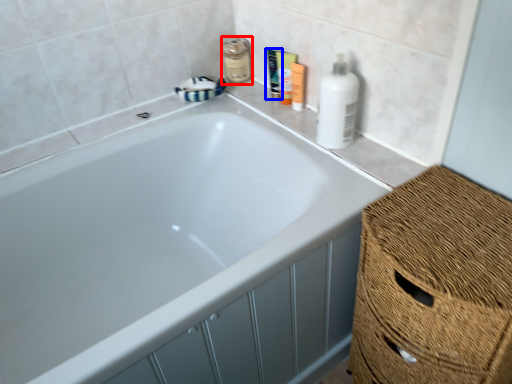
Question: Which point is closer to the camera, mouthwash (highlighted by a red box) or toiletry (highlighted by a blue box)?

Choices:
 (A) mouthwash
 (B) toiletry

Answer: (B)